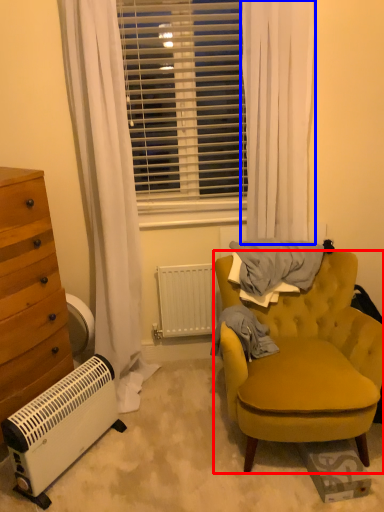
Question: Which of the following is the closest to the observer, chair (highlighted by a red box) or curtain (highlighted by a blue box)?

Choices:
 (A) chair
 (B) curtain

Answer: (A)